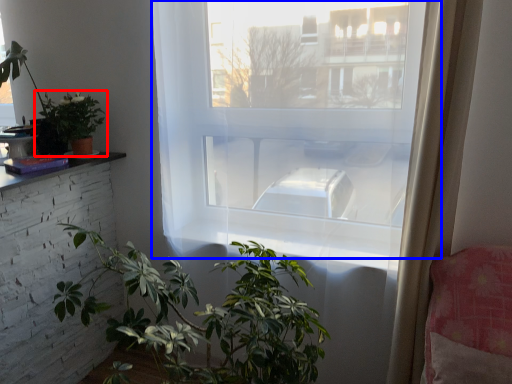
Question: Among these objects, which one is farthest to the camera, houseplant (highlighted by a red box) or window (highlighted by a blue box)?

Choices:
 (A) houseplant
 (B) window

Answer: (A)